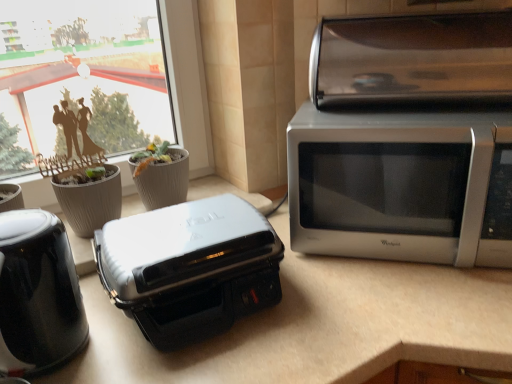
Question: From the image's perspective, is gray textured flowerpot at center, which is the first flowerpot in right-to-left order, located beneath white glossy countertop at center?

Choices:
 (A) no
 (B) yes

Answer: (A)

Question: Does gray textured flowerpot at center, placed as the 2th flowerpot when sorted from left to right, have a greater height compared to white glossy countertop at center?

Choices:
 (A) yes
 (B) no

Answer: (B)

Question: From a real-world perspective, is gray textured flowerpot at center, which is the first flowerpot in right-to-left order, on top of white glossy countertop at center?

Choices:
 (A) yes
 (B) no

Answer: (A)

Question: Is white glossy countertop at center at the back of gray textured flowerpot at center, placed as the 2th flowerpot when sorted from left to right?

Choices:
 (A) yes
 (B) no

Answer: (B)

Question: Can you confirm if gray textured flowerpot at center, which is the first flowerpot in right-to-left order, is thinner than white glossy countertop at center?

Choices:
 (A) no
 (B) yes

Answer: (B)

Question: Is gray textured flowerpot at center, placed as the 2th flowerpot when sorted from left to right, facing towards white glossy countertop at center?

Choices:
 (A) no
 (B) yes

Answer: (A)

Question: Is satin silver microwave at right behind satin silver toaster oven at upper right?

Choices:
 (A) yes
 (B) no

Answer: (B)

Question: Can you confirm if satin silver microwave at right is shorter than satin silver toaster oven at upper right?

Choices:
 (A) yes
 (B) no

Answer: (B)

Question: Can you confirm if satin silver microwave at right is wider than satin silver toaster oven at upper right?

Choices:
 (A) no
 (B) yes

Answer: (B)

Question: Is satin silver microwave at right located outside satin silver toaster oven at upper right?

Choices:
 (A) no
 (B) yes

Answer: (B)

Question: From the image's perspective, is satin silver microwave at right over satin silver toaster oven at upper right?

Choices:
 (A) yes
 (B) no

Answer: (B)

Question: From a real-world perspective, is satin silver microwave at right physically above satin silver toaster oven at upper right?

Choices:
 (A) yes
 (B) no

Answer: (B)

Question: Is white glossy countertop at center positioned with its back to satin silver microwave at right?

Choices:
 (A) no
 (B) yes

Answer: (A)